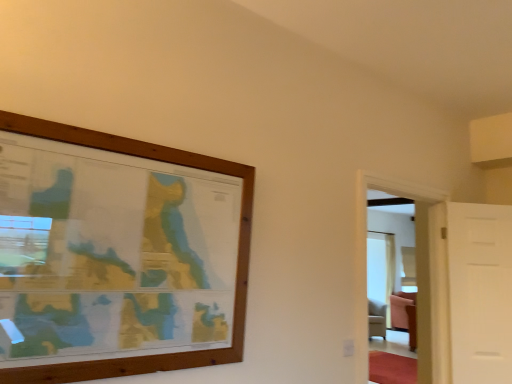
Question: Is white matte door at right aimed at transparent glass door at right?

Choices:
 (A) yes
 (B) no

Answer: (B)

Question: From the image's perspective, does white matte door at right appear lower than transparent glass door at right?

Choices:
 (A) no
 (B) yes

Answer: (B)

Question: Is the depth of white matte door at right greater than that of transparent glass door at right?

Choices:
 (A) yes
 (B) no

Answer: (A)

Question: Considering the relative positions of white matte door at right and transparent glass door at right in the image provided, is white matte door at right to the right of transparent glass door at right from the viewer's perspective?

Choices:
 (A) yes
 (B) no

Answer: (A)

Question: Considering the relative sizes of white matte door at right and transparent glass door at right in the image provided, is white matte door at right bigger than transparent glass door at right?

Choices:
 (A) no
 (B) yes

Answer: (A)

Question: Does white matte door at right have a greater width compared to transparent glass door at right?

Choices:
 (A) yes
 (B) no

Answer: (B)

Question: Considering the relative sizes of transparent glass door at right and white matte door at right in the image provided, is transparent glass door at right wider than white matte door at right?

Choices:
 (A) yes
 (B) no

Answer: (A)

Question: Is transparent glass door at right looking in the opposite direction of white matte door at right?

Choices:
 (A) no
 (B) yes

Answer: (A)

Question: Does transparent glass door at right have a larger size compared to white matte door at right?

Choices:
 (A) no
 (B) yes

Answer: (B)

Question: From a real-world perspective, is transparent glass door at right over white matte door at right?

Choices:
 (A) no
 (B) yes

Answer: (B)

Question: From the image's perspective, is transparent glass door at right located beneath white matte door at right?

Choices:
 (A) no
 (B) yes

Answer: (A)

Question: From the image's perspective, is transparent glass door at right located above white matte door at right?

Choices:
 (A) yes
 (B) no

Answer: (A)

Question: Visually, is transparent glass door at right positioned to the left or to the right of white matte door at right?

Choices:
 (A) right
 (B) left

Answer: (B)